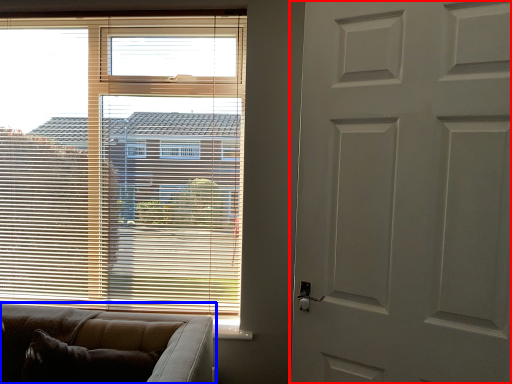
Question: Which point is further to the camera, door (highlighted by a red box) or studio couch (highlighted by a blue box)?

Choices:
 (A) door
 (B) studio couch

Answer: (B)